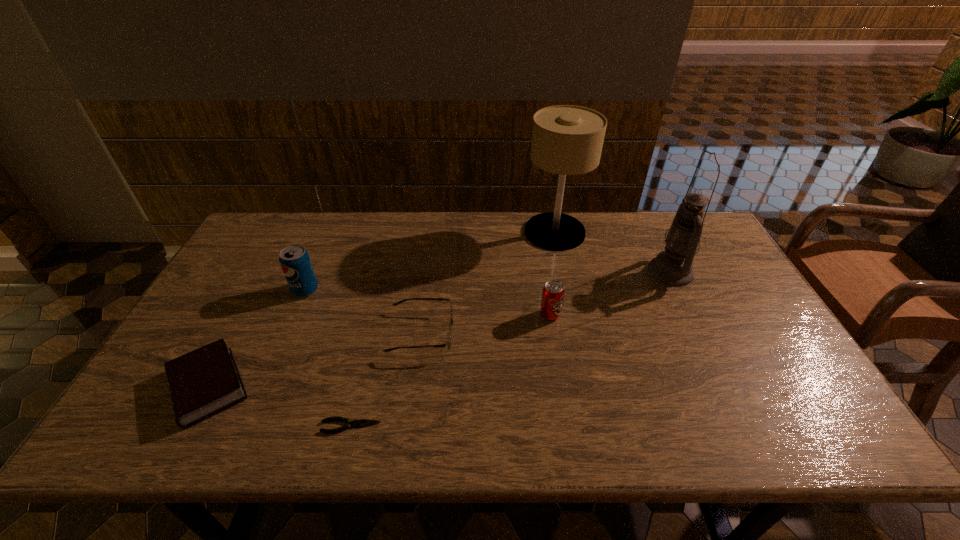
Where is `vacant space situated 0.080m on the left of the oil lamp`? The height and width of the screenshot is (540, 960). vacant space situated 0.080m on the left of the oil lamp is located at coordinates (623, 272).

The height and width of the screenshot is (540, 960). I want to click on vacant space located on the left of the taller soda, so click(x=272, y=290).

At what (x,y) coordinates should I click in order to perform the action: click on vacant region located on the right of the shorter soda. Please return your answer as a coordinate pair (x, y). Looking at the image, I should click on (629, 315).

Locate an element on the screen. The height and width of the screenshot is (540, 960). vacant space positioned on the front-facing side of the spectacles is located at coordinates (503, 334).

The height and width of the screenshot is (540, 960). I want to click on vacant space located on the right of the Bible, so click(x=278, y=387).

Find the location of a particular element. blank space located on the right of the pliers is located at coordinates (552, 426).

The image size is (960, 540). What are the coordinates of `object present at the far edge` in the screenshot? It's located at (566, 140).

Find the location of a particular element. The image size is (960, 540). Bible that is at the near edge is located at coordinates (206, 381).

This screenshot has height=540, width=960. Find the location of `pliers present at the near edge`. pliers present at the near edge is located at coordinates (362, 422).

Find the location of `object that is at the left edge`. object that is at the left edge is located at coordinates (206, 381).